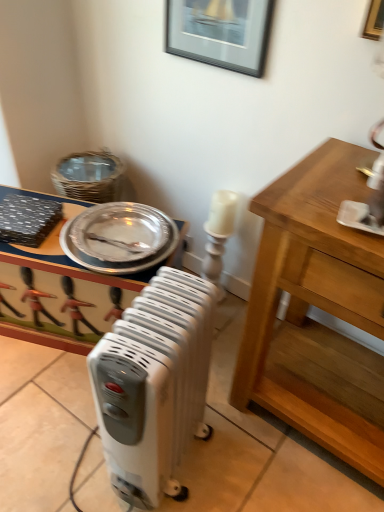
Identify the location of vacant space to the right of white plastic radiator at center. (251, 460).